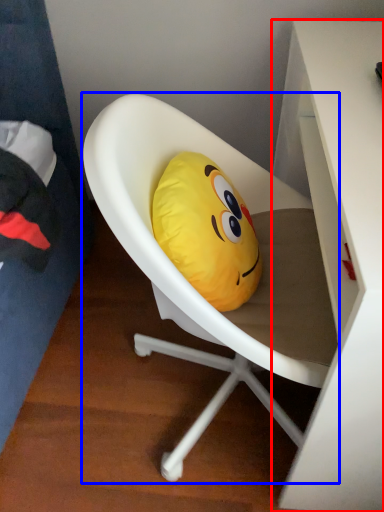
Question: Which of the following is the closest to the observer, desk (highlighted by a red box) or chair (highlighted by a blue box)?

Choices:
 (A) desk
 (B) chair

Answer: (A)